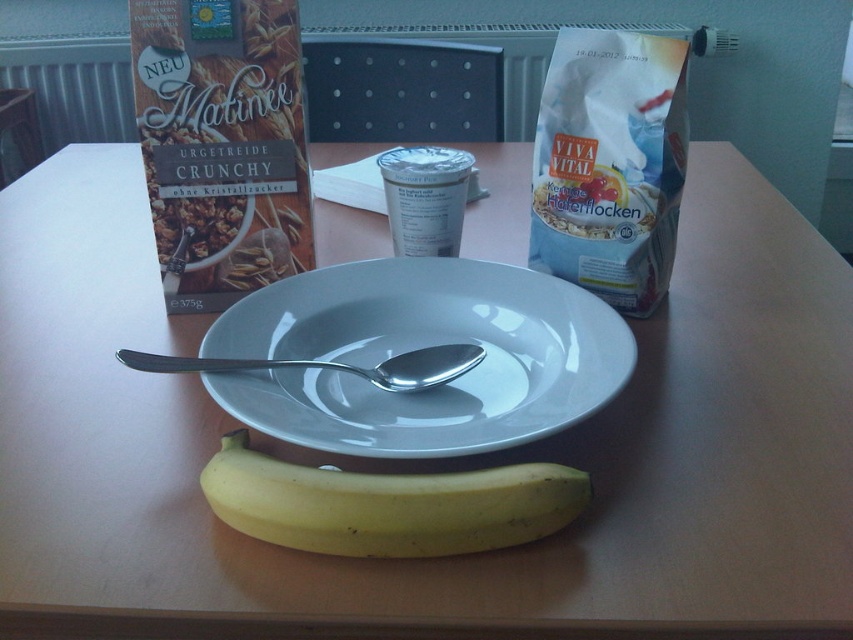
Question: Is white paper bag at upper right to the left of yellow matte banana at lower center from the viewer's perspective?

Choices:
 (A) yes
 (B) no

Answer: (B)

Question: Among these objects, which one is nearest to the camera?

Choices:
 (A) silver metallic spoon at center
 (B) yellow matte banana at lower center
 (C) white glossy plate at center

Answer: (B)

Question: Is white glossy plate at center in front of yellow matte banana at lower center?

Choices:
 (A) no
 (B) yes

Answer: (A)

Question: Which point is farther from the camera taking this photo?

Choices:
 (A) (376, 401)
 (B) (451, 243)

Answer: (B)

Question: Can you confirm if white paper bag at upper right is wider than silver metallic spoon at center?

Choices:
 (A) yes
 (B) no

Answer: (B)

Question: Which is farther from the white matte yogurt cup at center?

Choices:
 (A) silver metallic spoon at center
 (B) white paper bag at upper right
 (C) yellow matte banana at lower center

Answer: (C)